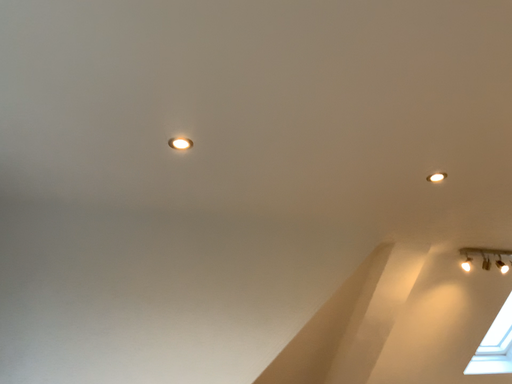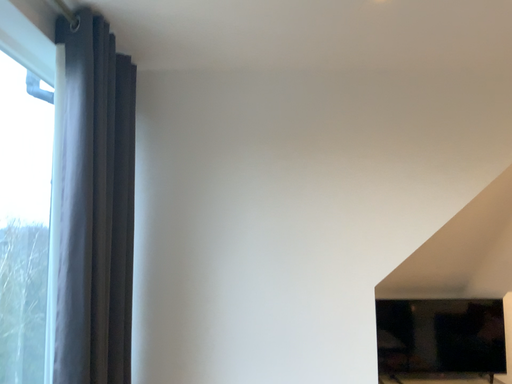
Question: Which way did the camera rotate in the video?

Choices:
 (A) rotated downward
 (B) rotated upward

Answer: (A)